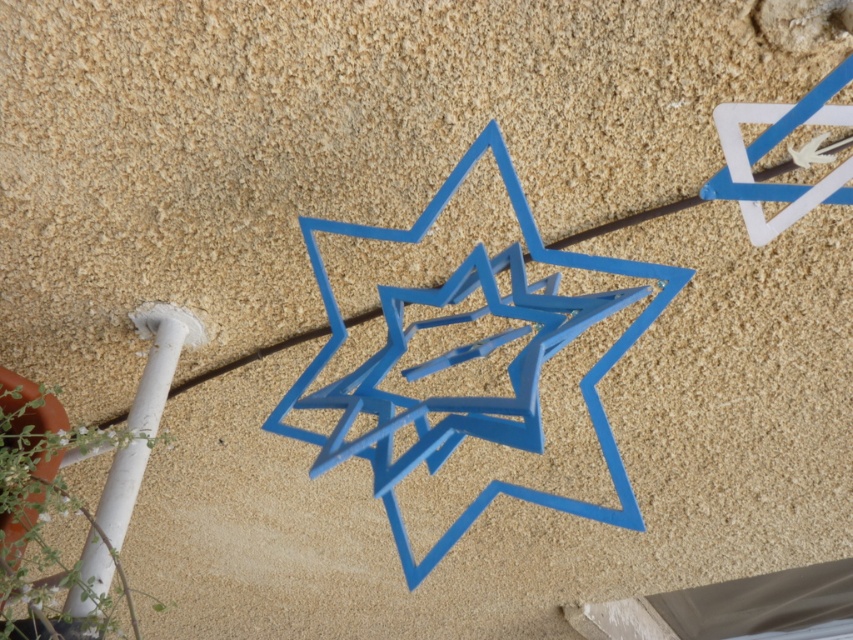
You are an interior designer planning to place a new decorative item between the white matte pole at lower left and the blue matte star at upper right. Based on their current positions, which object should you consider moving closer to the center of the image to create symmetry?

To create symmetry, you should move the white matte pole at lower left closer to the center because it is currently positioned on the left side of the blue matte star at upper right, which is further to the right. Bringing the pole towards the center would balance their positions.

You are an interior designer planning to place a decorative item on the beige surface. You have a new object that is 15 cm wide. The blue matte star at center and the white matte pole at lower left are already there. Can the new object fit between them without overlapping?

The blue matte star at center is wider than the white matte pole at lower left. Since the new object is 15 cm wide, you need to check the space between them. If the distance between the two existing objects is greater than 15 cm, it can fit. However, without knowing the exact distance, we can only confirm that the blue matte star at center is wider, but the placement depends on their spacing.